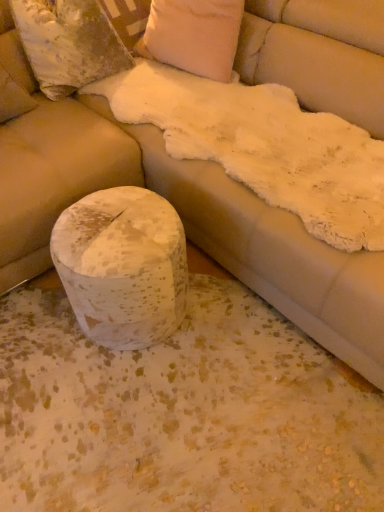
This screenshot has width=384, height=512. I want to click on distressed fabric pillow at upper left, so click(x=69, y=42).

What do you see at coordinates (69, 42) in the screenshot? This screenshot has height=512, width=384. I see `distressed fabric pillow at upper left` at bounding box center [69, 42].

Locate an element on the screen. distressed fabric pillow at upper left is located at coordinates (69, 42).